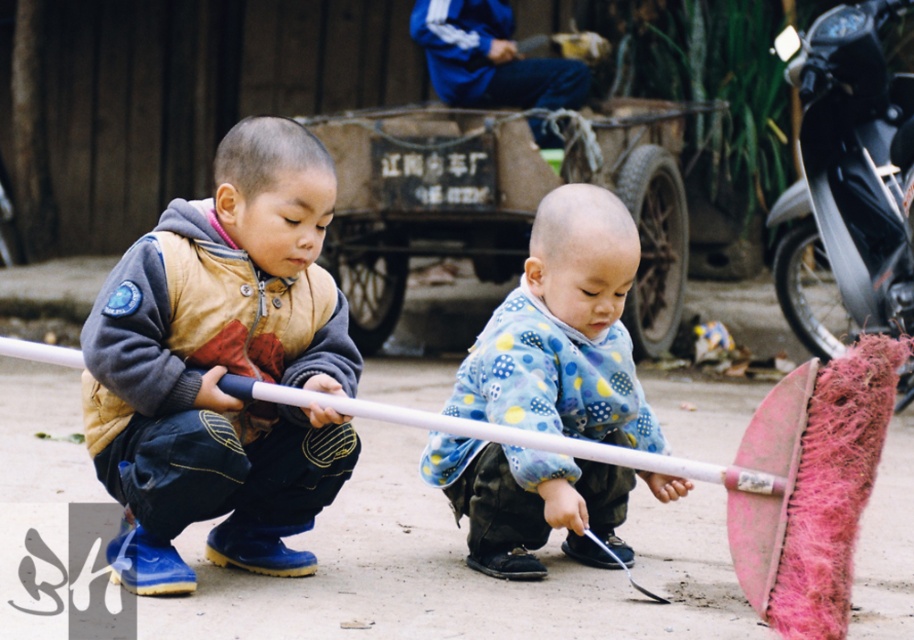
You are a photographer planning to take a picture of the children and their surroundings. You need to ensure that both the brown suede jacket at center and the rusty metal wagon at center are clearly visible in the frame. Based on their positions, which object should be placed closer to the left side of the photo to maintain their natural arrangement?

The brown suede jacket at center should be placed closer to the left side of the photo because it is naturally positioned to the left of the rusty metal wagon at center in the scene.

You are a photographer trying to capture a clear photo of the rusty metal wagon at center and the blue fleece jacket at center. Since you want both objects to be in focus, which one should you adjust the camera focus on first?

The rusty metal wagon at center is further to the viewer than the blue fleece jacket at center, so you should focus on the rusty metal wagon at center first to ensure both are in focus.

You are a photographer trying to capture a photo of the rusty metal wagon at center. You notice the brown suede jacket at center is blocking your view. Can you move the jacket to the side to get a clear shot of the wagon?

The brown suede jacket at center is in front of the rusty metal wagon at center, so moving the jacket would allow you to see the wagon clearly.